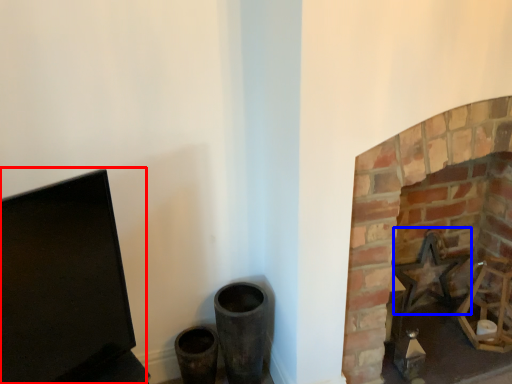
Question: Which point is closer to the camera, computer monitor (highlighted by a red box) or swivel chair (highlighted by a blue box)?

Choices:
 (A) computer monitor
 (B) swivel chair

Answer: (A)